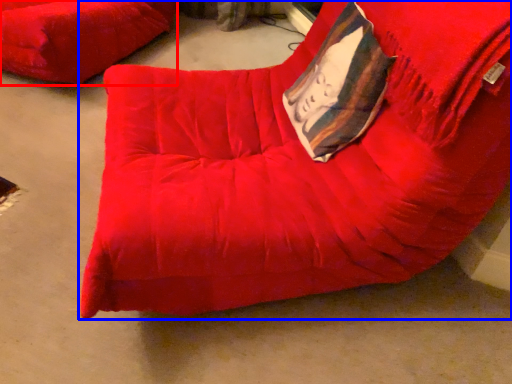
Question: Which point is closer to the camera, furniture (highlighted by a red box) or furniture (highlighted by a blue box)?

Choices:
 (A) furniture
 (B) furniture

Answer: (B)